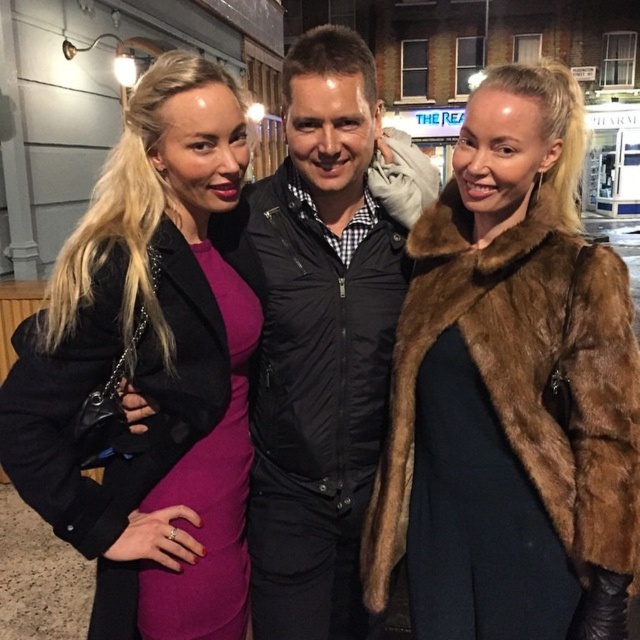
Between black quilted jacket at center and brown fur coat at right, which one is positioned lower?

brown fur coat at right is lower down.

Does black quilted jacket at center have a greater height compared to brown fur coat at right?

Indeed, black quilted jacket at center has a greater height compared to brown fur coat at right.

Image resolution: width=640 pixels, height=640 pixels. Find the location of `black quilted jacket at center`. black quilted jacket at center is located at coordinates (320, 346).

The image size is (640, 640). In order to click on black quilted jacket at center in this screenshot , I will do `click(320, 346)`.

Who is shorter, matte black coat at left or brown fur coat at right?

brown fur coat at right is shorter.

Is matte black coat at left positioned behind brown fur coat at right?

That is True.

Image resolution: width=640 pixels, height=640 pixels. Identify the location of matte black coat at left. (150, 365).

The height and width of the screenshot is (640, 640). Identify the location of matte black coat at left. [x=150, y=365].

Can you confirm if matte black coat at left is bigger than black quilted jacket at center?

No, matte black coat at left is not bigger than black quilted jacket at center.

Between matte black coat at left and black quilted jacket at center, which one has less height?

Standing shorter between the two is matte black coat at left.

Is point (144, 192) behind point (349, 627)?

No, (144, 192) is in front of (349, 627).

Find the location of a particular element. The height and width of the screenshot is (640, 640). matte black coat at left is located at coordinates (150, 365).